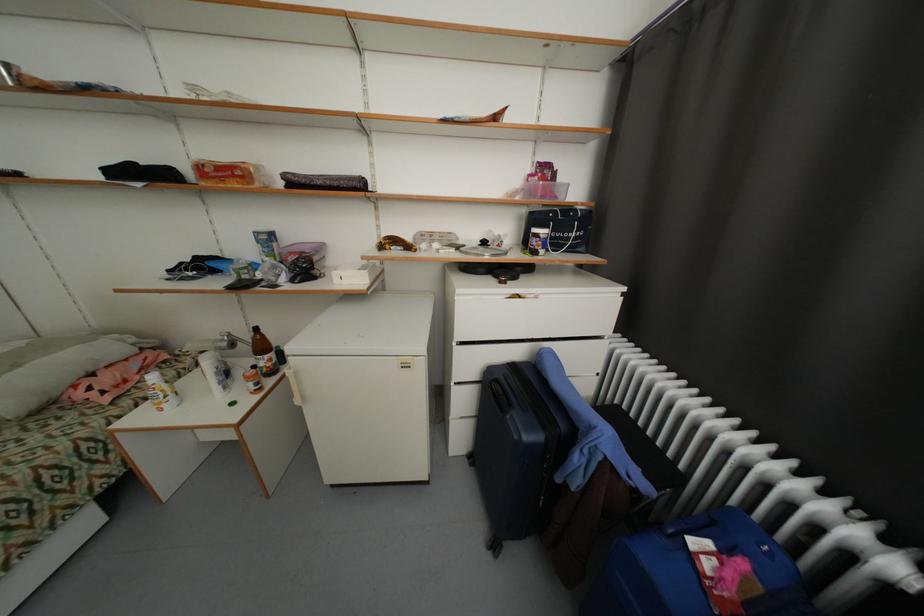
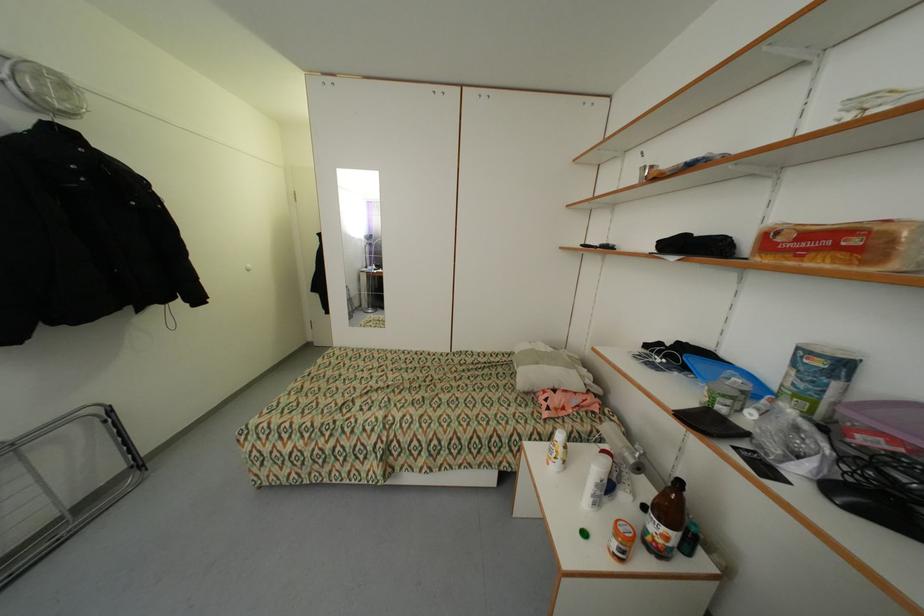
The point at (x=276, y=361) is marked in the first image. Where is the corresponding point in the second image?

(673, 540)